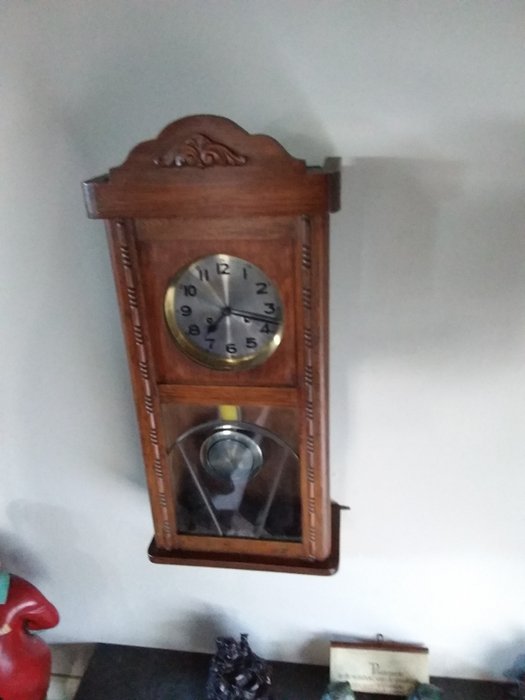
In order to click on table in this screenshot , I will do `click(109, 673)`.